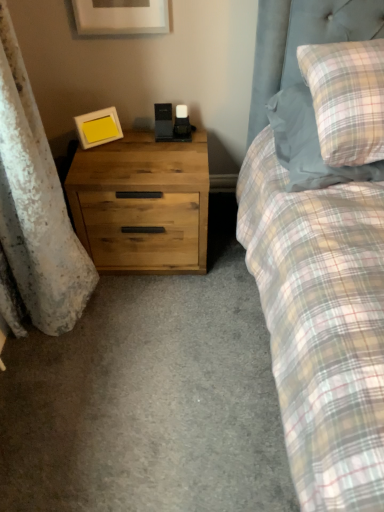
Identify the location of free space to the right of matte yellow picture frame at left, which appears as the 1th picture frame when viewed from the back. (142, 143).